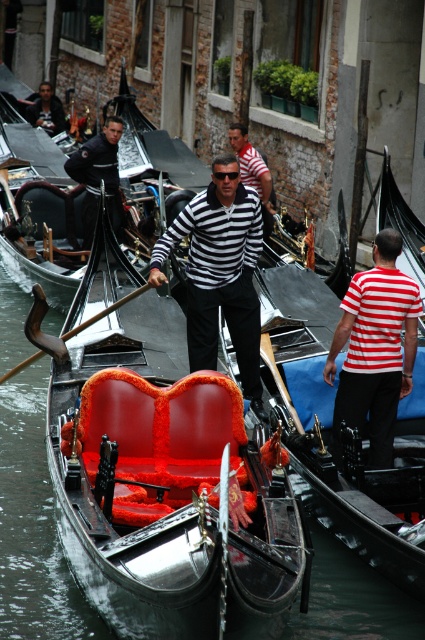
Does striped fabric shirt at center lie in front of red striped shirt at right?

That is False.

Between striped fabric shirt at center and red striped shirt at right, which one has more height?

red striped shirt at right

Which is in front, point (258, 371) or point (408, 294)?

Point (408, 294) is in front.

Find the location of `striped fabric shirt at center`. striped fabric shirt at center is located at coordinates (220, 273).

Is red striped shirt at right in front of dark blue leather jacket at upper left?

Yes, red striped shirt at right is in front of dark blue leather jacket at upper left.

Does red striped shirt at right have a smaller size compared to dark blue leather jacket at upper left?

Indeed, red striped shirt at right has a smaller size compared to dark blue leather jacket at upper left.

The height and width of the screenshot is (640, 425). In order to click on red striped shirt at right in this screenshot , I will do `click(374, 349)`.

Locate an element on the screen. Image resolution: width=425 pixels, height=640 pixels. red striped shirt at right is located at coordinates (374, 349).

What do you see at coordinates (159, 472) in the screenshot? This screenshot has width=425, height=640. I see `velvet red seat at center` at bounding box center [159, 472].

Does velvet red seat at center have a larger size compared to red striped shirt at right?

Correct, velvet red seat at center is larger in size than red striped shirt at right.

At what (x,y) coordinates should I click in order to perform the action: click on velvet red seat at center. Please return your answer as a coordinate pair (x, y). The image size is (425, 640). Looking at the image, I should click on (159, 472).